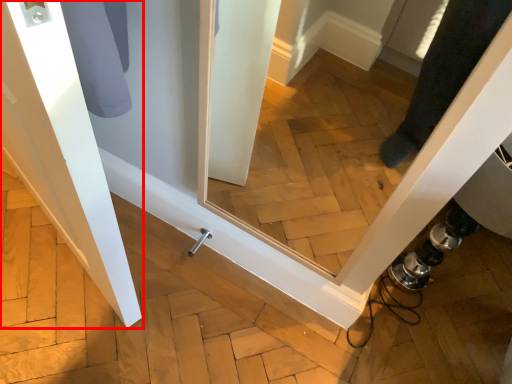
Question: From the image's perspective, considering the relative positions of door (annotated by the red box) and door handle in the image provided, where is door (annotated by the red box) located with respect to the staircase?

Choices:
 (A) above
 (B) below

Answer: (A)